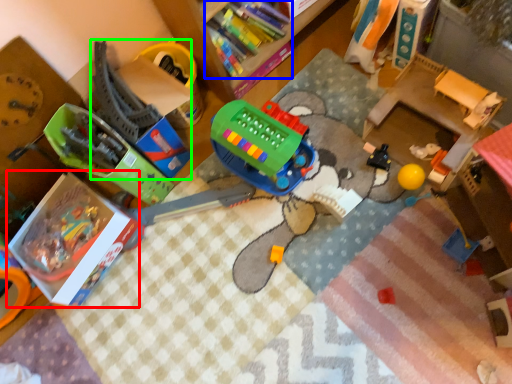
Question: Estimate the real-world distances between objects in this image. Which object is closer to box (highlighted by a red box), book (highlighted by a blue box) or toy (highlighted by a green box)?

Choices:
 (A) book
 (B) toy

Answer: (B)